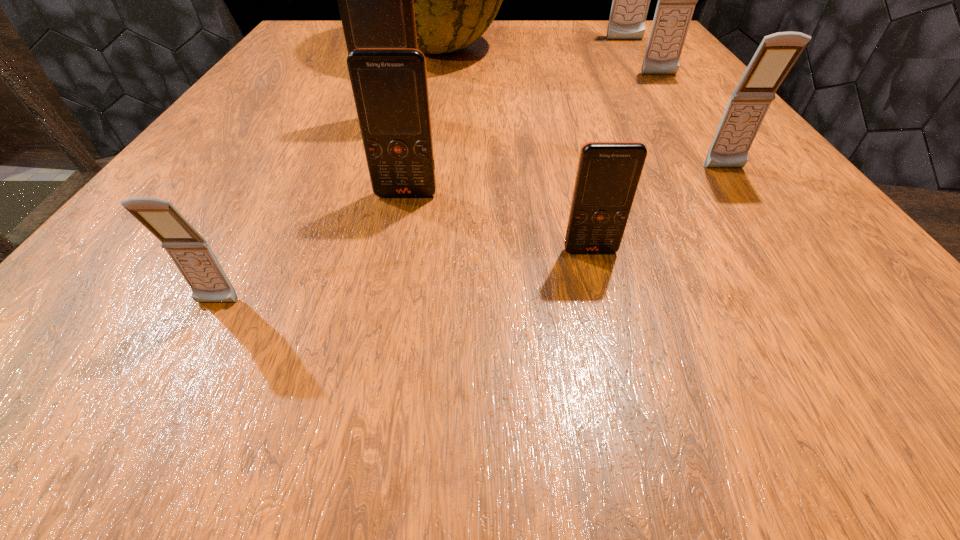
Locate an element on the screen. free space located 0.090m on the front-facing side of the third farthest gray cellular telephone is located at coordinates (756, 214).

The image size is (960, 540). In order to click on vacant space positioned on the screen of the sixth farthest object in this screenshot , I will do `click(379, 331)`.

The height and width of the screenshot is (540, 960). In order to click on vacant space located 0.130m on the screen of the rightmost orange cellular telephone in this screenshot , I will do `click(616, 353)`.

Image resolution: width=960 pixels, height=540 pixels. I want to click on free space located on the front-facing side of the leftmost cellular telephone, so click(180, 371).

At what (x,y) coordinates should I click in order to perform the action: click on watermelon that is at the far edge. Please return your answer as a coordinate pair (x, y). Image resolution: width=960 pixels, height=540 pixels. Looking at the image, I should click on (455, 0).

You are a GUI agent. You are given a task and a screenshot of the screen. Output one action in this format:
    pyautogui.click(x=<x>, y=<y>)
    Task: Click on the cellular telephone that is at the far edge
    
    Given the screenshot: What is the action you would take?
    tap(631, 0)

The image size is (960, 540). Identify the location of object present at the left edge. (190, 252).

Locate an element on the screen. The height and width of the screenshot is (540, 960). object present at the far right corner is located at coordinates (631, 0).

Image resolution: width=960 pixels, height=540 pixels. In the image, there is a desktop. Identify the location of free region at the far edge. point(566,29).

This screenshot has width=960, height=540. In the image, there is a desktop. What are the coordinates of `vacant region at the near edge` in the screenshot? It's located at (240, 326).